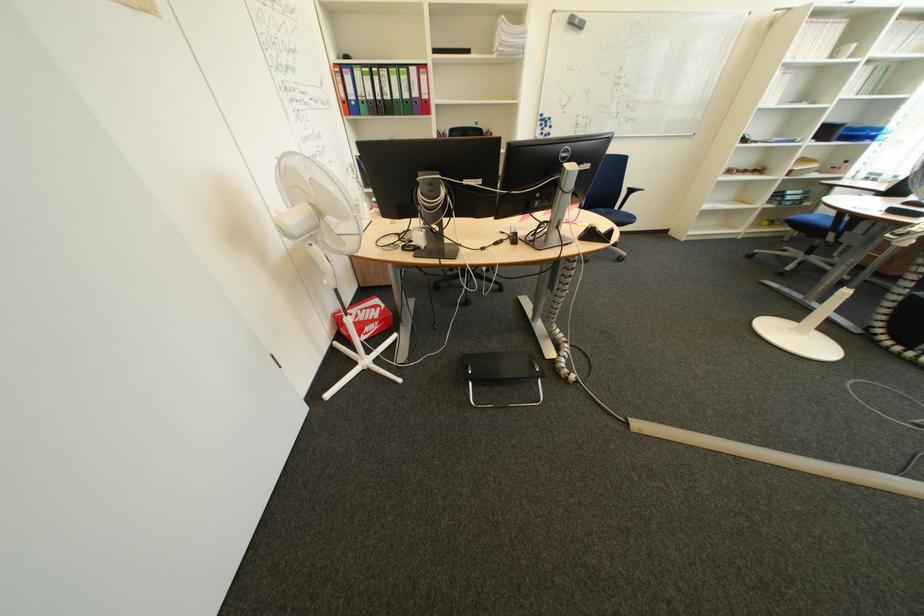
What do you see at coordinates (766, 223) in the screenshot? I see `the green binder finger hole` at bounding box center [766, 223].